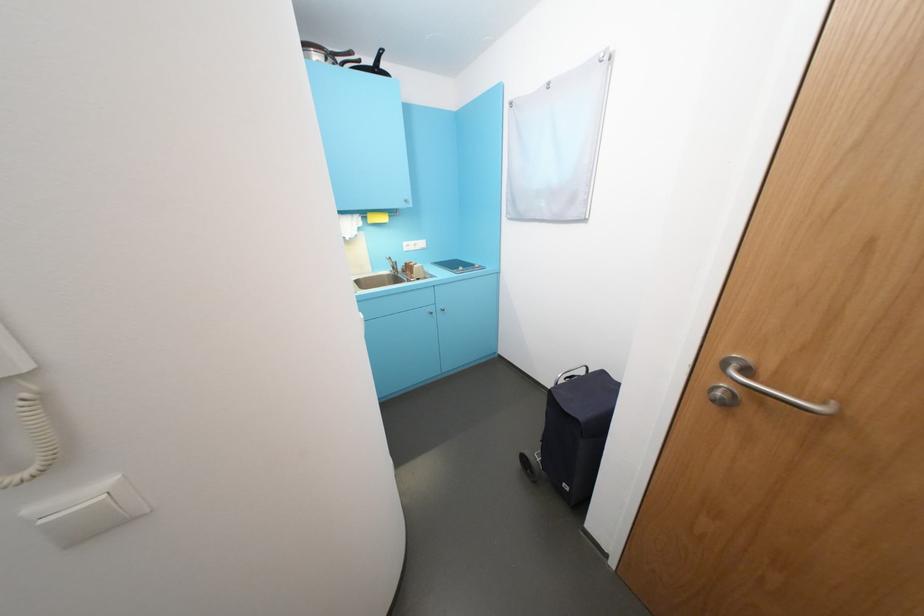
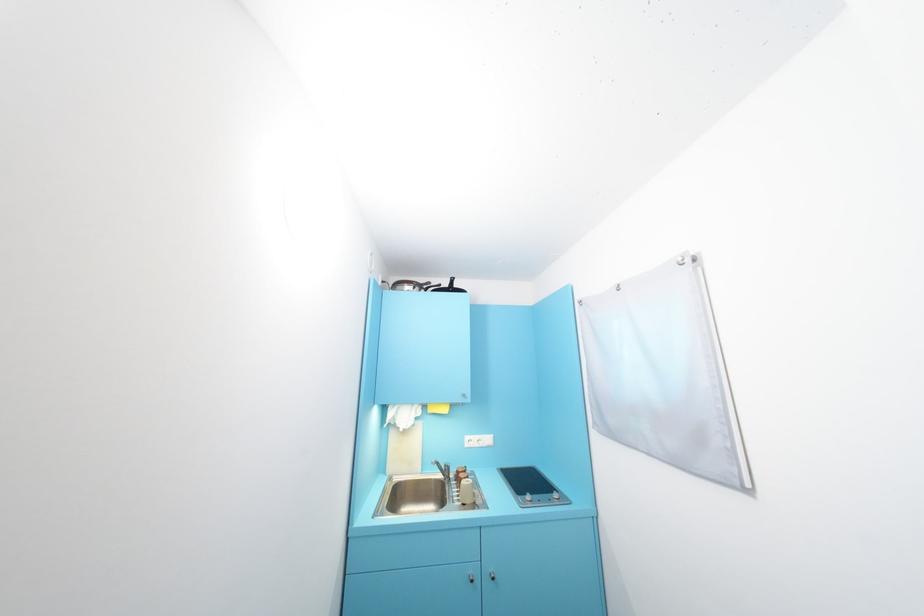
Locate, in the second image, the point that corresponds to (x=380, y=65) in the first image.

(455, 286)